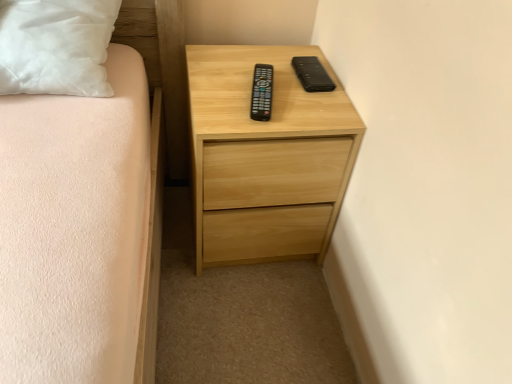
This screenshot has width=512, height=384. Identify the location of vacant space situated on the left part of black matte case at upper right. (250, 74).